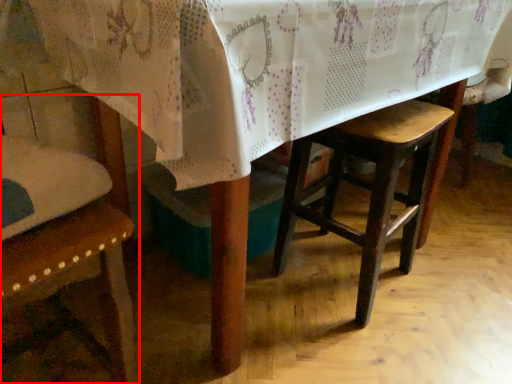
Question: From the image, what is the correct spatial relationship of chair (annotated by the red box) in relation to stool?

Choices:
 (A) right
 (B) left

Answer: (B)